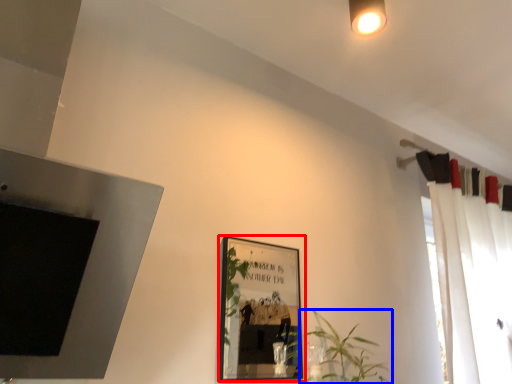
Question: Which object is closer to the camera taking this photo, picture frame (highlighted by a red box) or houseplant (highlighted by a blue box)?

Choices:
 (A) picture frame
 (B) houseplant

Answer: (A)